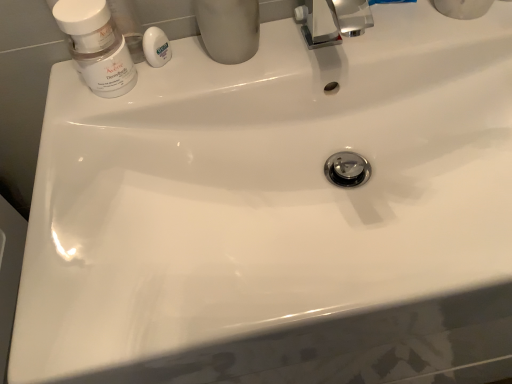
I want to click on vacant space that is to the left of matte gray cup at upper center, so click(132, 102).